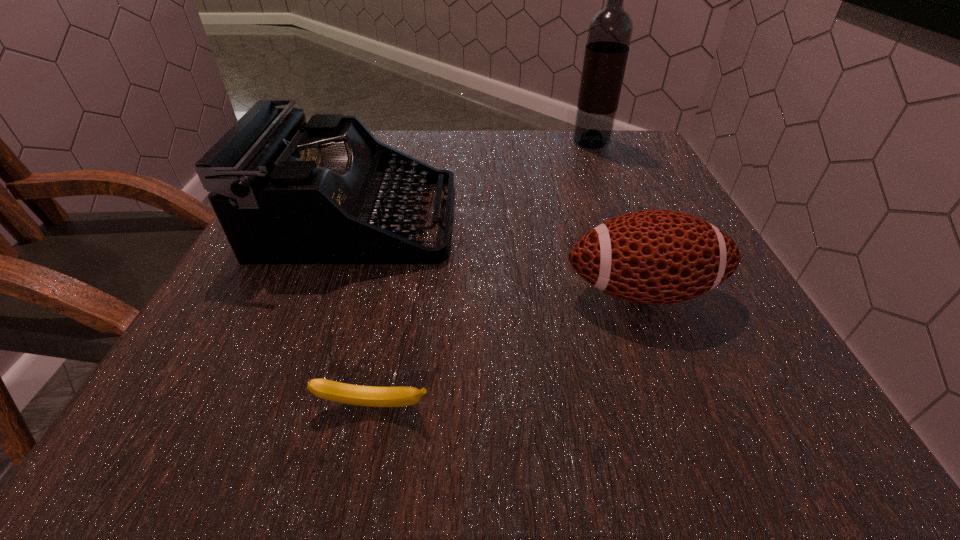
At what (x,y) coordinates should I click in order to perform the action: click on object that is positioned at the near edge. Please return your answer as a coordinate pair (x, y). The height and width of the screenshot is (540, 960). Looking at the image, I should click on (373, 396).

This screenshot has height=540, width=960. Identify the location of object that is at the left edge. (285, 191).

You are a GUI agent. You are given a task and a screenshot of the screen. Output one action in this format:
    pyautogui.click(x=<x>, y=<y>)
    Task: Click on the wine bottle at the right edge
    The width and height of the screenshot is (960, 540).
    Given the screenshot: What is the action you would take?
    pyautogui.click(x=610, y=31)

Where is `football located at the right edge`? The width and height of the screenshot is (960, 540). football located at the right edge is located at coordinates (654, 257).

Locate an element on the screen. The image size is (960, 540). object at the far right corner is located at coordinates (610, 31).

Locate an element on the screen. The height and width of the screenshot is (540, 960). vacant space at the far edge of the desktop is located at coordinates (583, 162).

You are a GUI agent. You are given a task and a screenshot of the screen. Output one action in this format:
    pyautogui.click(x=<x>, y=<y>)
    Task: Click on the vacant space at the near edge of the desktop
    This screenshot has height=540, width=960.
    Given the screenshot: What is the action you would take?
    pyautogui.click(x=451, y=400)

In the image, there is a desktop. Identify the location of vacant space at the left edge. (214, 314).

In the image, there is a desktop. In order to click on blank space at the right edge in this screenshot , I will do pos(657,319).

In the image, there is a desktop. Identify the location of vacant area at the far left corner. Image resolution: width=960 pixels, height=540 pixels. (376, 131).